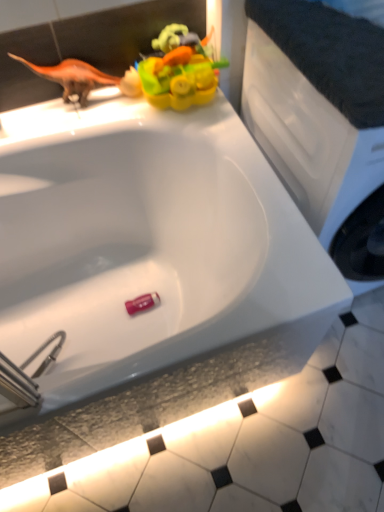
Question: Considering the relative positions of pink plastic eraser at bottom, which ranks as the 2th toy in front-to-back order, and white matte counter top at upper right in the image provided, is pink plastic eraser at bottom, which ranks as the 2th toy in front-to-back order, to the right of white matte counter top at upper right from the viewer's perspective?

Choices:
 (A) no
 (B) yes

Answer: (A)

Question: From the image's perspective, is pink plastic eraser at bottom, acting as the second toy starting from the top, beneath white matte counter top at upper right?

Choices:
 (A) yes
 (B) no

Answer: (A)

Question: Could white matte counter top at upper right be considered to be inside pink plastic eraser at bottom, the 1th toy when ordered from back to front?

Choices:
 (A) yes
 (B) no

Answer: (B)

Question: Can you confirm if pink plastic eraser at bottom, the 1th toy when ordered from back to front, is shorter than white matte counter top at upper right?

Choices:
 (A) no
 (B) yes

Answer: (B)

Question: Does pink plastic eraser at bottom, the 1th toy when ordered from back to front, appear on the left side of white matte counter top at upper right?

Choices:
 (A) yes
 (B) no

Answer: (A)

Question: Would you say orange matte dinosaur at upper left is to the left or to the right of white glossy tile at lower center in the picture?

Choices:
 (A) left
 (B) right

Answer: (A)

Question: From a real-world perspective, relative to white glossy tile at lower center, is orange matte dinosaur at upper left vertically above or below?

Choices:
 (A) below
 (B) above

Answer: (B)

Question: From their relative heights in the image, would you say orange matte dinosaur at upper left is taller or shorter than white glossy tile at lower center?

Choices:
 (A) short
 (B) tall

Answer: (B)

Question: Is point (24, 59) closer or farther from the camera than point (122, 489)?

Choices:
 (A) closer
 (B) farther

Answer: (A)

Question: Considering the positions of point (200, 460) and point (160, 66), is point (200, 460) closer or farther from the camera than point (160, 66)?

Choices:
 (A) farther
 (B) closer

Answer: (A)

Question: Is white glossy tile at lower center wider or thinner than rubber duck at upper center, which is the second toy in back-to-front order?

Choices:
 (A) thin
 (B) wide

Answer: (B)

Question: From their relative heights in the image, would you say white glossy tile at lower center is taller or shorter than rubber duck at upper center, which ranks as the 2th toy in bottom-to-top order?

Choices:
 (A) tall
 (B) short

Answer: (B)

Question: Is white glossy tile at lower center situated inside rubber duck at upper center, which is the second toy in back-to-front order, or outside?

Choices:
 (A) inside
 (B) outside

Answer: (B)

Question: Relative to white matte counter top at upper right, is rubber duck at upper center, which appears as the first toy when viewed from the front, in front or behind?

Choices:
 (A) behind
 (B) front

Answer: (A)

Question: Considering the relative positions of rubber duck at upper center, which ranks as the 2th toy in bottom-to-top order, and white matte counter top at upper right in the image provided, is rubber duck at upper center, which ranks as the 2th toy in bottom-to-top order, to the left or to the right of white matte counter top at upper right?

Choices:
 (A) left
 (B) right

Answer: (A)